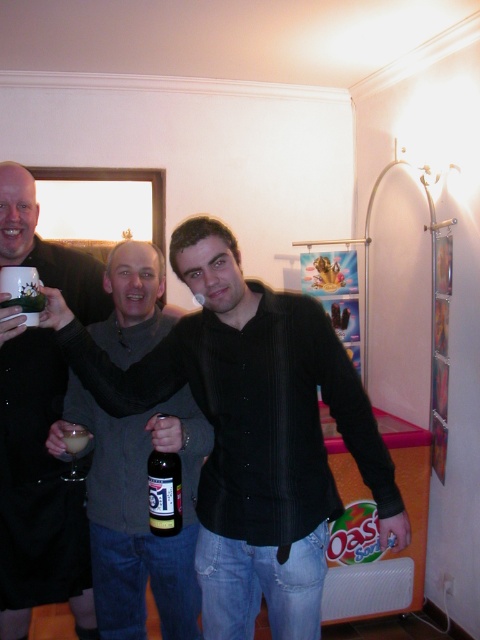
Question: Estimate the real-world distances between objects in this image. Which object is closer to the brown glass bottle at center?

Choices:
 (A) black matte shirt at center
 (B) matte black mug at upper left

Answer: (A)

Question: Does black matte shirt at center appear over gray sweater at center?

Choices:
 (A) no
 (B) yes

Answer: (B)

Question: Can you confirm if black matte shirt at center is positioned to the right of brown glass bottle at center?

Choices:
 (A) no
 (B) yes

Answer: (B)

Question: Which point appears farthest from the camera in this image?

Choices:
 (A) (204, 413)
 (B) (66, 392)

Answer: (B)

Question: Is black matte shirt at center above translucent glass beer at center?

Choices:
 (A) no
 (B) yes

Answer: (B)

Question: Which of the following is the closest to the observer?

Choices:
 (A) brown glass bottle at center
 (B) translucent glass beer at center
 (C) matte black mug at upper left

Answer: (A)